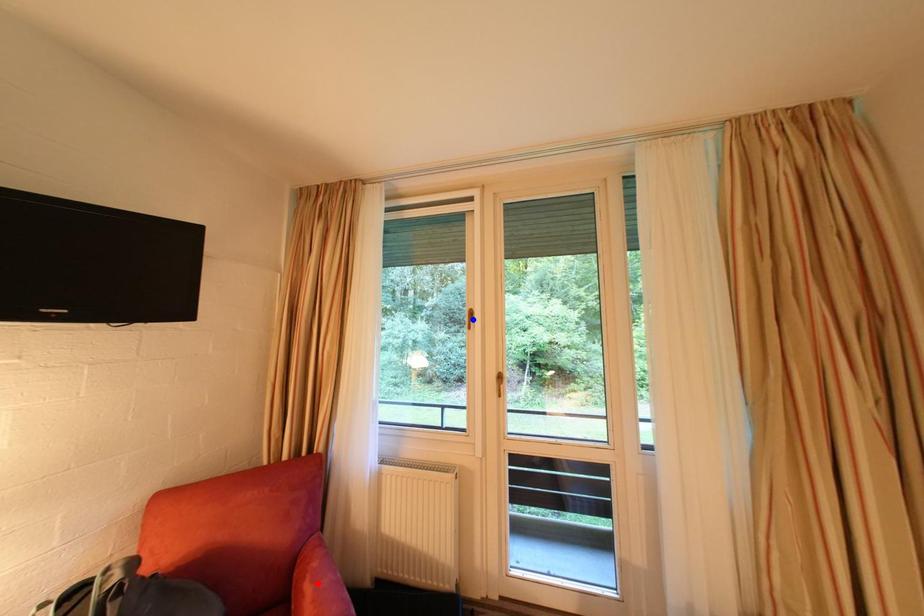
Question: In the image, two points are highlighted. Which point is nearer to the camera? Reply with the corresponding letter.

Choices:
 (A) blue point
 (B) red point

Answer: (B)